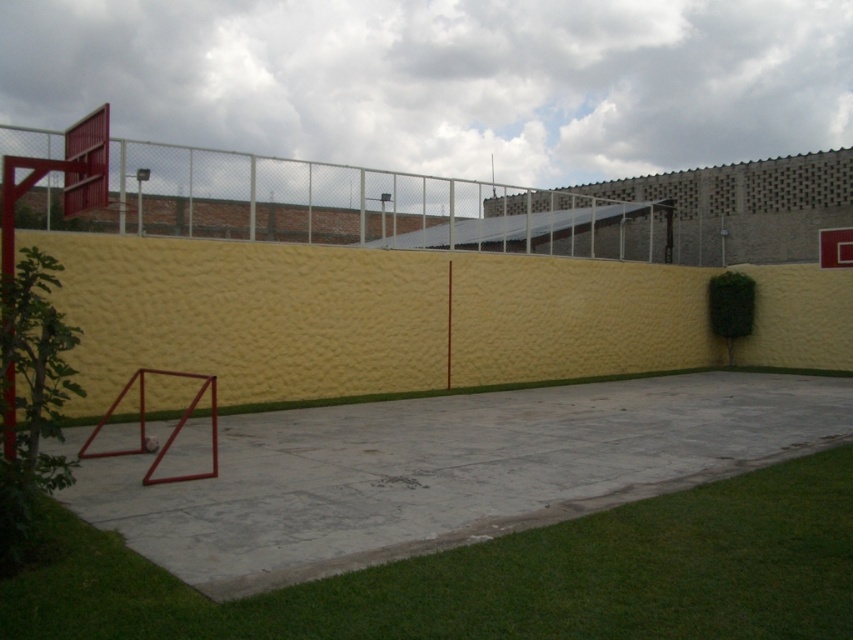
Question: Is green grass at lower left thinner than metallic red basketball hoop at upper left?

Choices:
 (A) yes
 (B) no

Answer: (A)

Question: Does green grass at lower left appear on the left side of metallic red basketball hoop at upper left?

Choices:
 (A) yes
 (B) no

Answer: (B)

Question: Which of the following is the farthest from the observer?

Choices:
 (A) metallic red basketball hoop at upper left
 (B) green grass at lower left

Answer: (A)

Question: Can you confirm if green grass at lower left is wider than metallic red basketball hoop at upper left?

Choices:
 (A) no
 (B) yes

Answer: (A)